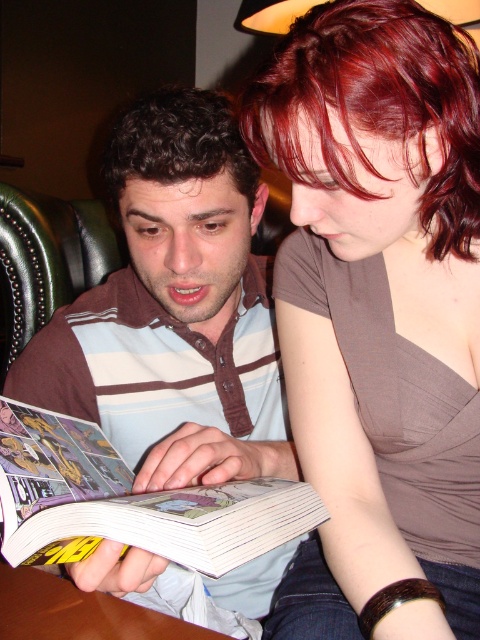
Question: Estimate the real-world distances between objects in this image. Which object is farther from the comic book paper at center?

Choices:
 (A) brown satin blouse at upper right
 (B) dark brown hair at upper center
 (C) brown striped shirt at center

Answer: (B)

Question: Which point appears farthest from the camera in this image?

Choices:
 (A) (81, 433)
 (B) (261, 67)

Answer: (A)

Question: Considering the relative positions of comic book paper at center and brown curly hair at center in the image provided, where is comic book paper at center located with respect to brown curly hair at center?

Choices:
 (A) right
 (B) left

Answer: (B)

Question: Estimate the real-world distances between objects in this image. Which object is farther from the brown satin blouse at upper right?

Choices:
 (A) brown curly hair at center
 (B) dark brown hair at upper center
 (C) comic book paper at center

Answer: (A)

Question: Is dark brown hair at upper center further to camera compared to comic book paper at center?

Choices:
 (A) no
 (B) yes

Answer: (B)

Question: Can you confirm if brown striped shirt at center is wider than comic book paper at center?

Choices:
 (A) no
 (B) yes

Answer: (B)